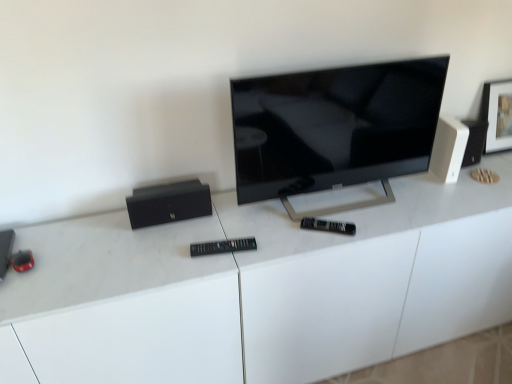
At what (x,y) coordinates should I click in order to perform the action: click on spots to the right of white plastic speaker at upper right, arranged as the 3th speaker when viewed from the left. Please return your answer as a coordinate pair (x, y). Looking at the image, I should click on (481, 181).